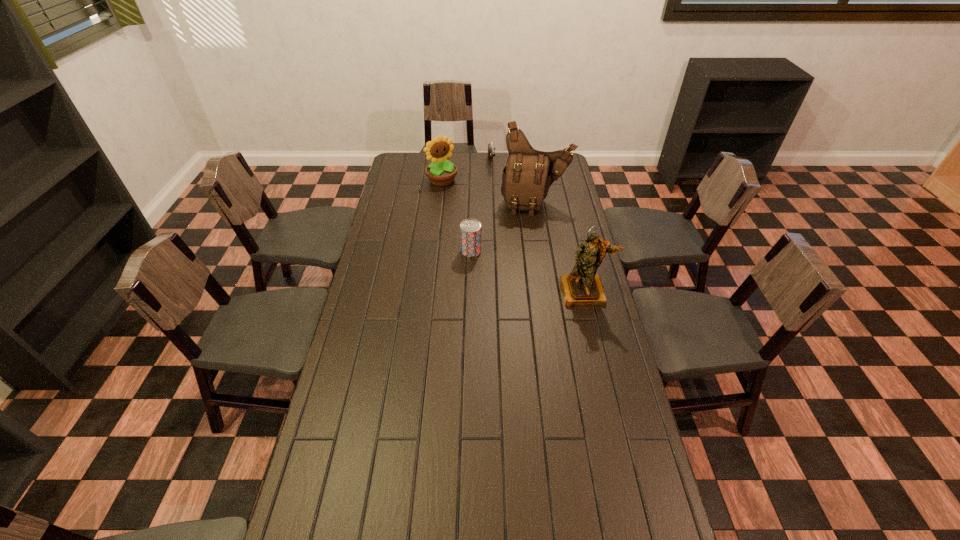
Find the location of `vacant space on the desktop that is between the beer can and the figurine and is positioned at the barrel of the third object from right to left`. vacant space on the desktop that is between the beer can and the figurine and is positioned at the barrel of the third object from right to left is located at coordinates (513, 266).

Where is `vacant space on the desktop that is between the second nearest object and the figurine and is positioned on the face of the third shortest object`? vacant space on the desktop that is between the second nearest object and the figurine and is positioned on the face of the third shortest object is located at coordinates (510, 265).

Image resolution: width=960 pixels, height=540 pixels. I want to click on free space on the desktop that is between the fourth farthest object and the figurine and is positioned on the front-facing side of the tallest object, so click(x=537, y=274).